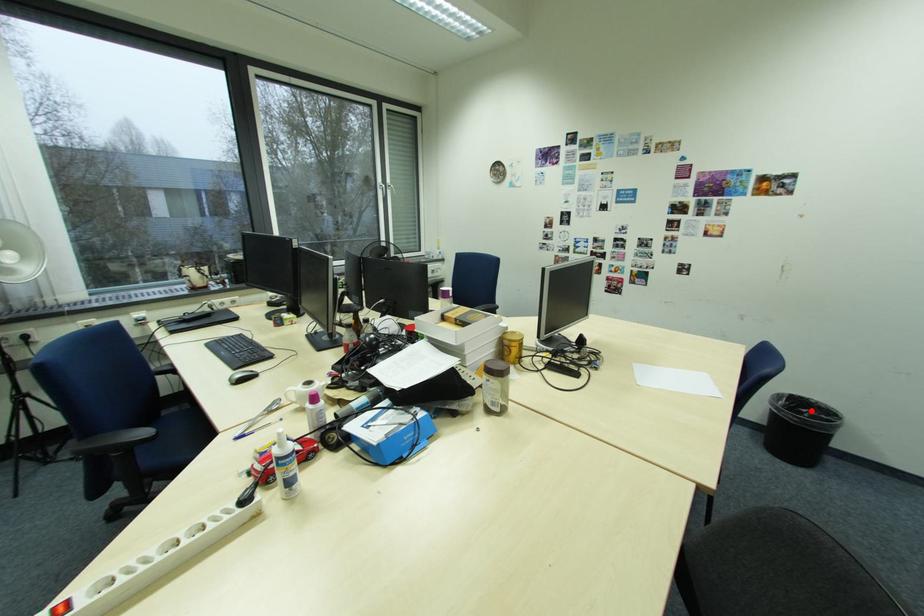
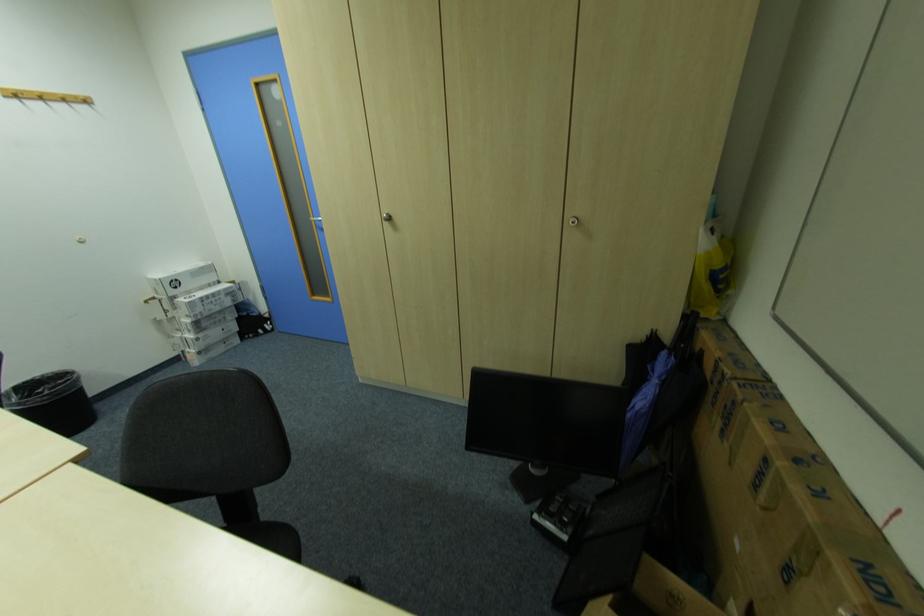
Question: I am providing you with two images of the same scene from different viewpoints. Image1 has a red point marked. In image2, the corresponding 3D location appears at what relative position? Reply with the corresponding letter.

Choices:
 (A) Closer
 (B) Farther

Answer: (B)